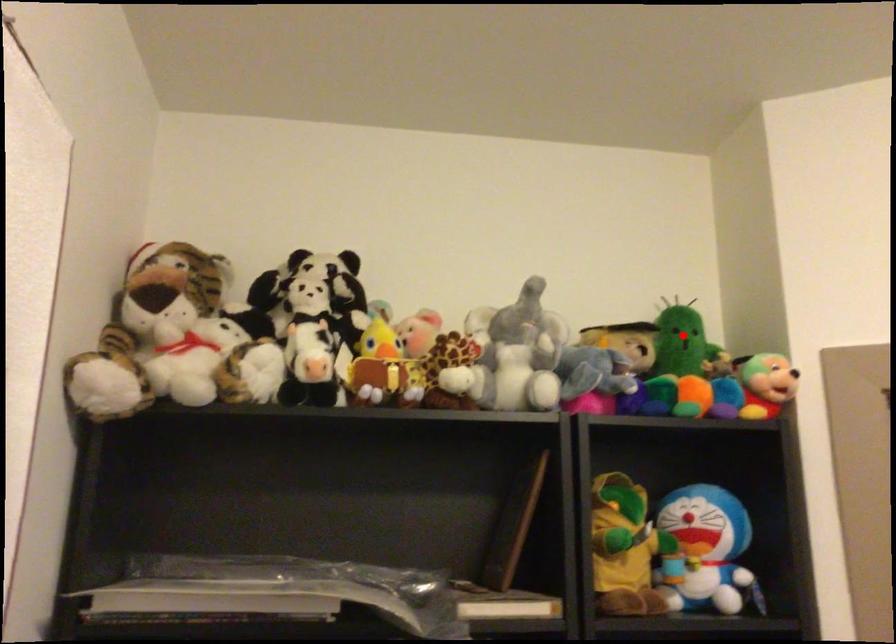
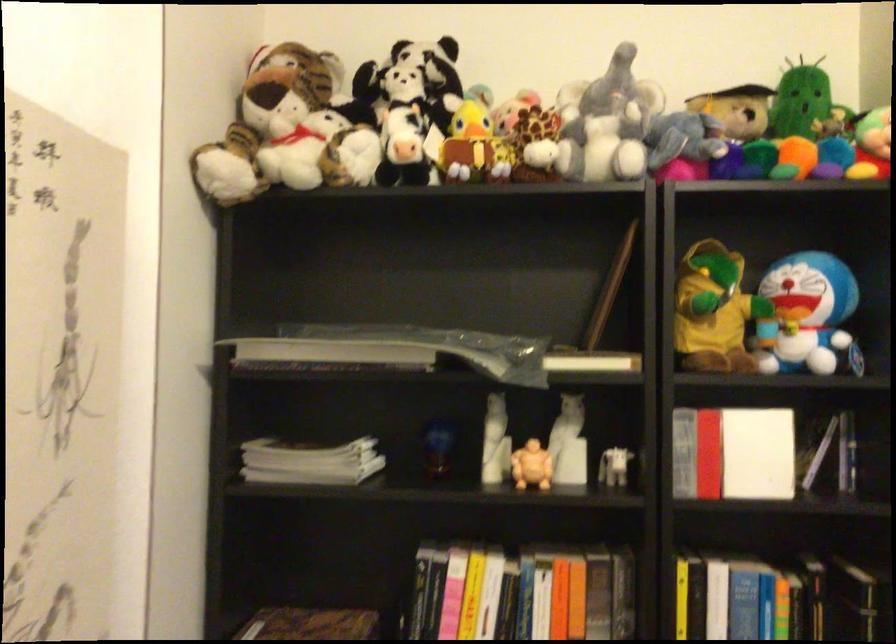
Question: I am providing you with two images of the same scene from different viewpoints. A red point is marked on the first image. Can you still see the location of the red point in image 2?

Choices:
 (A) Yes
 (B) No

Answer: (A)